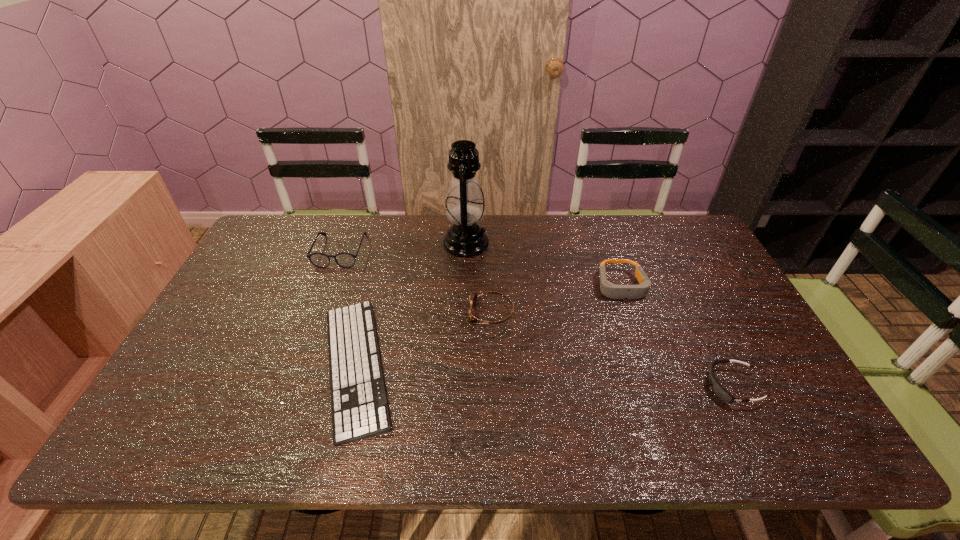
Image resolution: width=960 pixels, height=540 pixels. I want to click on object at the near edge, so click(x=359, y=408).

You are a GUI agent. You are given a task and a screenshot of the screen. Output one action in this format:
    pyautogui.click(x=<x>, y=<y>)
    Task: Click on the object at the right edge
    
    Given the screenshot: What is the action you would take?
    pyautogui.click(x=718, y=389)

Image resolution: width=960 pixels, height=540 pixels. In the image, there is a desktop. Identify the location of vacant space at the far edge. (413, 222).

Locate an element on the screen. free space at the near edge of the desktop is located at coordinates (504, 438).

The width and height of the screenshot is (960, 540). In order to click on vacant space at the left edge of the desktop in this screenshot , I will do `click(228, 286)`.

In the image, there is a desktop. Identify the location of vacant space at the right edge. The height and width of the screenshot is (540, 960). (740, 368).

This screenshot has height=540, width=960. I want to click on vacant space at the near left corner of the desktop, so click(x=156, y=426).

The image size is (960, 540). In order to click on free space at the far right corner of the desktop in this screenshot , I will do `click(658, 226)`.

Where is `vacant space that's between the fourth shortest object and the spectacles`? The image size is (960, 540). vacant space that's between the fourth shortest object and the spectacles is located at coordinates (481, 268).

Locate an element on the screen. free point between the leftmost goggles and the nearest goggles is located at coordinates (612, 349).